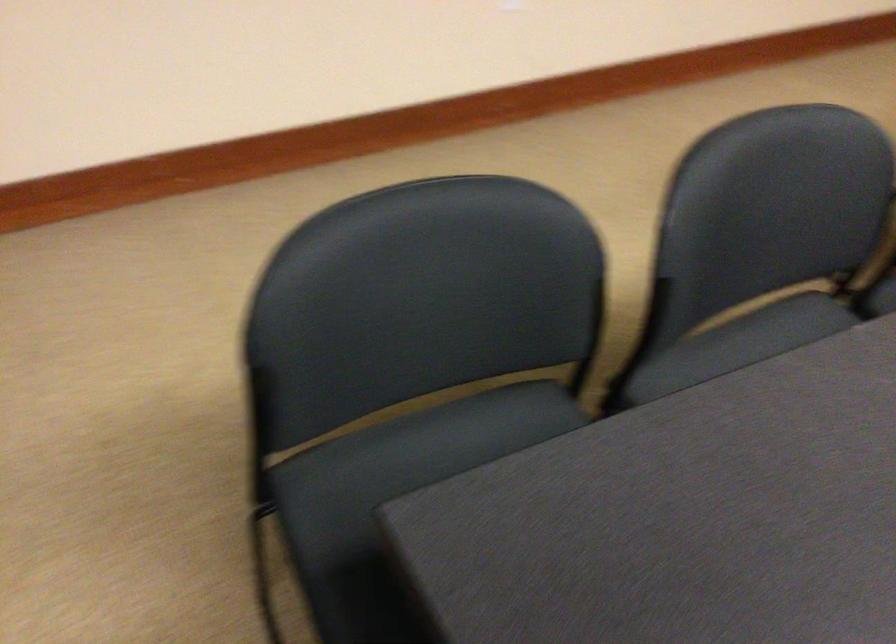
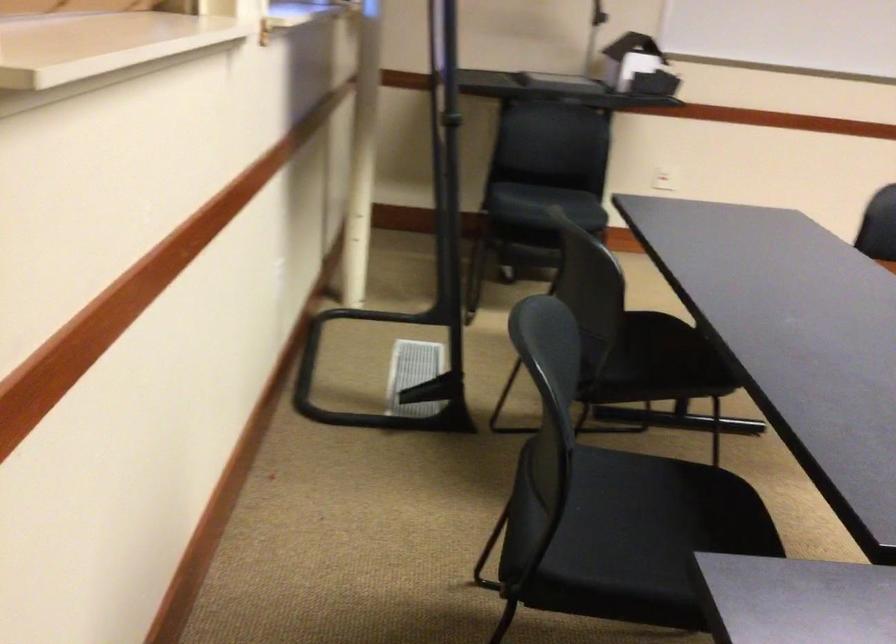
First-person continuous shooting, in which direction is the camera rotating?

The camera rotated toward right-down.